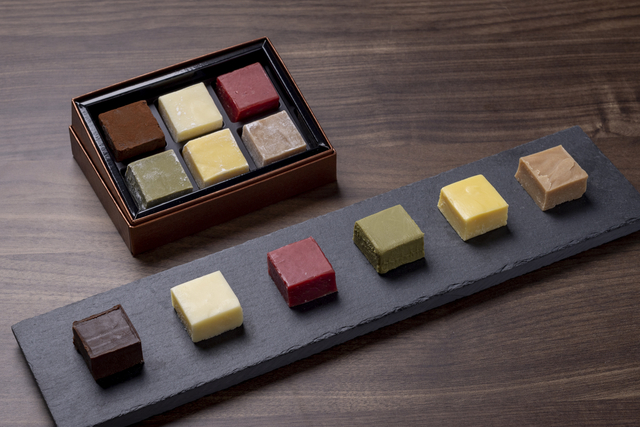
At what (x,y) coordinates should I click in order to perform the action: click on tray. Please return your answer as a coordinate pair (x, y). The width and height of the screenshot is (640, 427). Looking at the image, I should click on (54, 355).